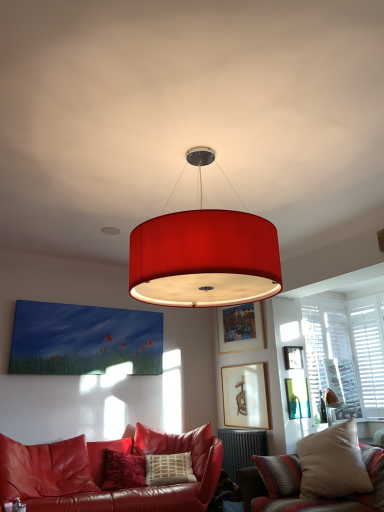
Question: From the image's perspective, is wooden picture frame at upper center, which is the third picture frame in bottom-to-top order, positioned above or below matte wooden picture frame at center, the 1th picture frame in the bottom-to-top sequence?

Choices:
 (A) below
 (B) above

Answer: (B)

Question: In terms of size, does wooden picture frame at upper center, which is the third picture frame in bottom-to-top order, appear bigger or smaller than matte wooden picture frame at center, the 1th picture frame in the bottom-to-top sequence?

Choices:
 (A) big
 (B) small

Answer: (B)

Question: Which object is positioned closest to the velvet beige pillow at lower right, the second studio couch viewed from the left?

Choices:
 (A) matte wooden picture frame at center, which is counted as the 4th picture frame, starting from the top
 (B) satin red couch at lower left, which is the 2th studio couch from right to left
 (C) white wooden shutters at right
 (D) dark gray metallic radiator at lower center
 (E) matte red drum shade at center

Answer: (B)

Question: Based on their relative distances, which object is nearer to the matte gold picture frame at upper right, which is the 2th picture frame from bottom to top?

Choices:
 (A) wooden picture frame at upper center, the second picture frame in the top-to-bottom sequence
 (B) matte red drum shade at center
 (C) satin red couch at lower left, which is the 2th studio couch from right to left
 (D) matte wooden picture frame at center, the 1th picture frame in the bottom-to-top sequence
 (E) velvet beige pillow at lower right, the second studio couch viewed from the left

Answer: (A)